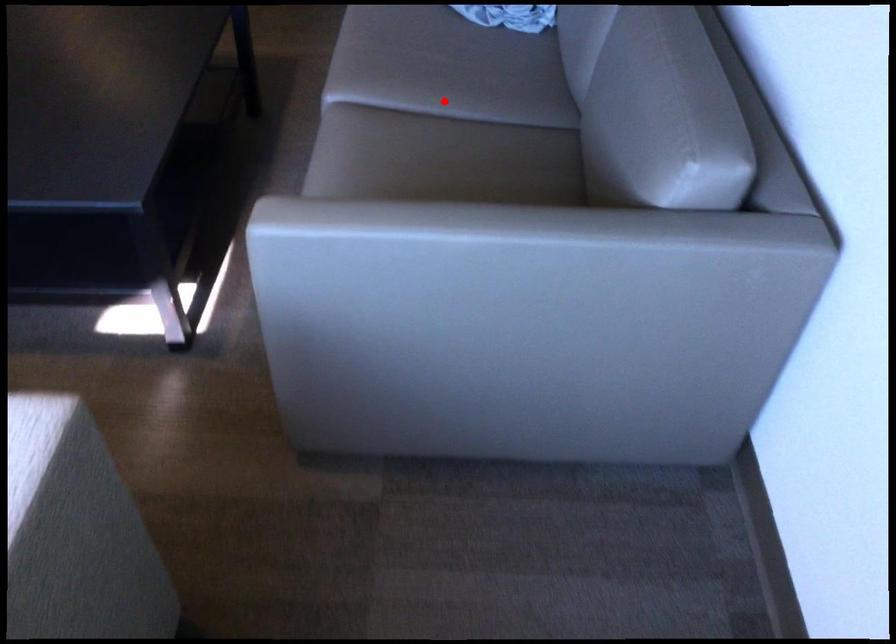
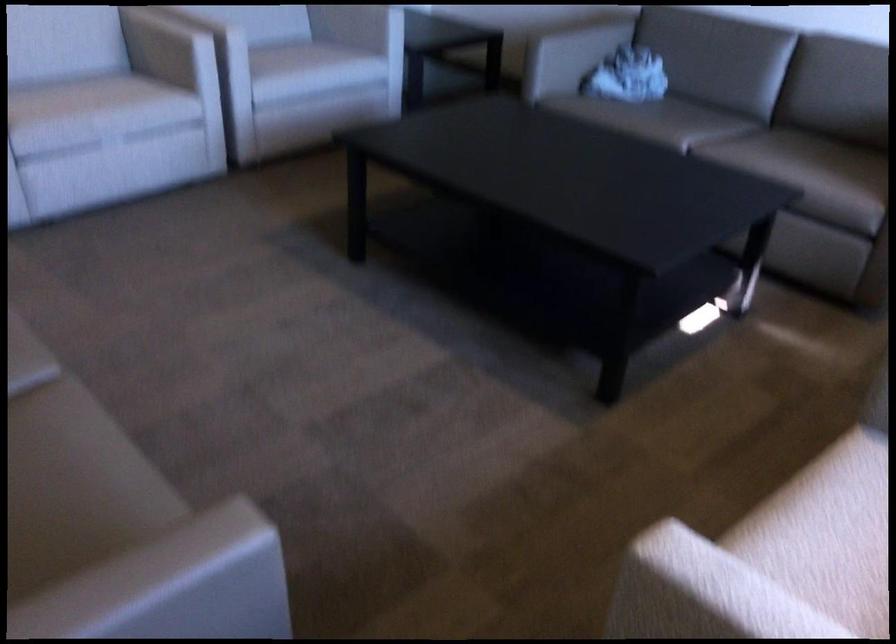
Question: I am providing you with two images of the same scene from different viewpoints. A red point is shown in image1. For the corresponding object point in image2, is it positioned nearer or farther from the camera?

Choices:
 (A) Nearer
 (B) Farther

Answer: (B)